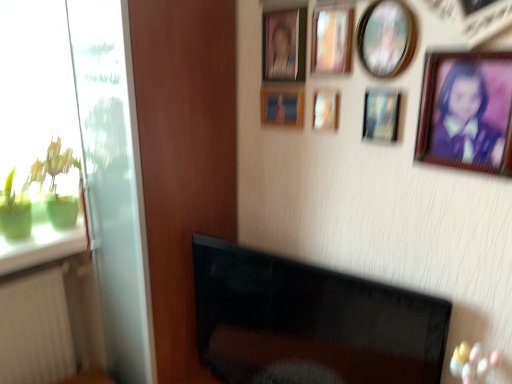
Where is `free space above green glass at left (from a real-world perspective)`? The height and width of the screenshot is (384, 512). free space above green glass at left (from a real-world perspective) is located at coordinates (44, 235).